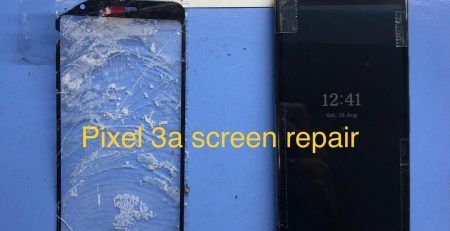
This screenshot has height=231, width=450. I want to click on black phone, so click(342, 181).